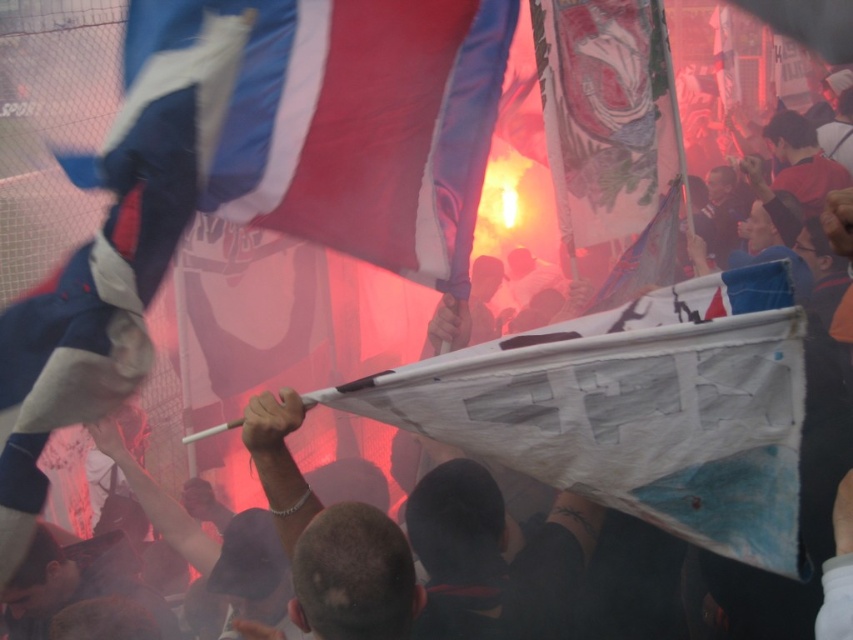
You are a photographer at the event and want to capture both the blue fabric flag at upper left and the white paper flag at center in a single shot. Which flag should you focus on first to ensure both are in focus?

You should focus on the blue fabric flag at upper left first because it is closer to the viewer than the white paper flag at center. By focusing on the closer object, the depth of field may allow both to be in focus.

You are a photographer at the event and want to capture both the blue fabric flag at upper left and the white paper flag at center in a single shot. Based on their positions, which flag should be placed closer to the bottom of the frame to ensure both are visible?

The blue fabric flag at upper left is below the white paper flag at center, so to include both in the frame, the blue fabric flag at upper left should be positioned closer to the bottom since it is already lower than the white paper flag at center.

You are a photographer at the event and want to capture both the blue and white fabric flag at upper left and the white paper flag at center in a single frame. Which flag should you focus on first to ensure both are in the frame?

The blue and white fabric flag at upper left is wider than the white paper flag at center, so focusing on the blue and white fabric flag at upper left first will ensure both flags fit within the frame.